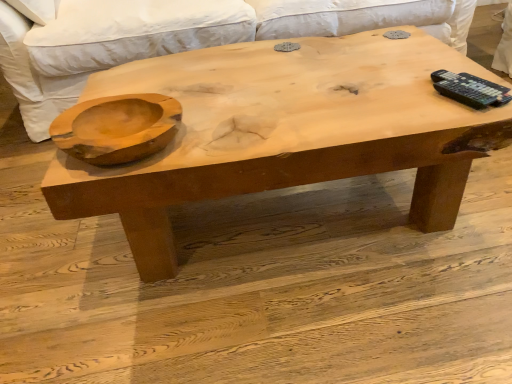
Question: Does natural wood coffee table at center contain natural wood bowl at left?

Choices:
 (A) no
 (B) yes

Answer: (A)

Question: Is natural wood coffee table at center far from natural wood bowl at left?

Choices:
 (A) yes
 (B) no

Answer: (B)

Question: Does natural wood coffee table at center lie behind natural wood bowl at left?

Choices:
 (A) yes
 (B) no

Answer: (A)

Question: From a real-world perspective, is natural wood coffee table at center physically below natural wood bowl at left?

Choices:
 (A) no
 (B) yes

Answer: (B)

Question: Is natural wood bowl at left at the back of natural wood coffee table at center?

Choices:
 (A) no
 (B) yes

Answer: (A)

Question: Is natural wood coffee table at center inside or outside of white fabric couch at upper center?

Choices:
 (A) outside
 (B) inside

Answer: (A)

Question: Is point (440, 54) positioned closer to the camera than point (393, 1)?

Choices:
 (A) closer
 (B) farther

Answer: (A)

Question: From a real-world perspective, is natural wood coffee table at center physically located above or below white fabric couch at upper center?

Choices:
 (A) above
 (B) below

Answer: (B)

Question: In the image, is natural wood coffee table at center positioned in front of or behind white fabric couch at upper center?

Choices:
 (A) front
 (B) behind

Answer: (A)

Question: In terms of height, does natural wood bowl at left look taller or shorter compared to natural wood coffee table at center?

Choices:
 (A) tall
 (B) short

Answer: (B)

Question: Which is correct: natural wood bowl at left is inside natural wood coffee table at center, or outside of it?

Choices:
 (A) outside
 (B) inside

Answer: (A)

Question: Is point (132, 148) closer or farther from the camera than point (232, 130)?

Choices:
 (A) closer
 (B) farther

Answer: (A)

Question: Is natural wood bowl at left in front of or behind natural wood coffee table at center in the image?

Choices:
 (A) behind
 (B) front

Answer: (B)

Question: From a real-world perspective, is natural wood bowl at left positioned above or below white fabric couch at upper center?

Choices:
 (A) below
 (B) above

Answer: (B)

Question: Is natural wood bowl at left bigger or smaller than white fabric couch at upper center?

Choices:
 (A) big
 (B) small

Answer: (B)